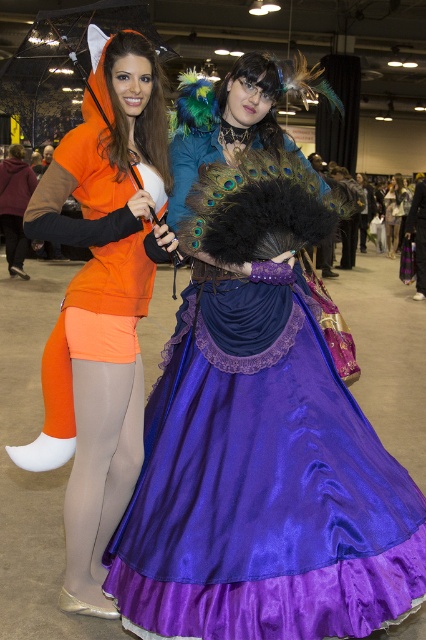
You are taking a photo of two costumed individuals at a convention. You want to focus on the point closer to the camera. Which point should you choose between point (144, 209) and point (396, 234)?

Point (144, 209) is closer to the camera than point (396, 234), so you should choose point (144, 209) to focus on.

You are a photographer at the event and want to capture a closeup shot of both the satin purple dress at center and the matte orange hoodie at left. Your camera has a maximum focus range of 16 inches. Can you fit both subjects within the focus range?

The distance between the satin purple dress at center and the matte orange hoodie at left is 15.82 inches, which is within the camera focus range of 16 inches. Therefore, both subjects can be captured in focus.

You are standing in the convention hall and want to take a photo of both the matte orange hoodie at left and the purple satin dress at center. Which costume should you focus on first to ensure it is in the foreground of your photo?

The matte orange hoodie at left is closer to the viewer than the purple satin dress at center, so you should focus on the matte orange hoodie at left first to ensure it is in the foreground of your photo.